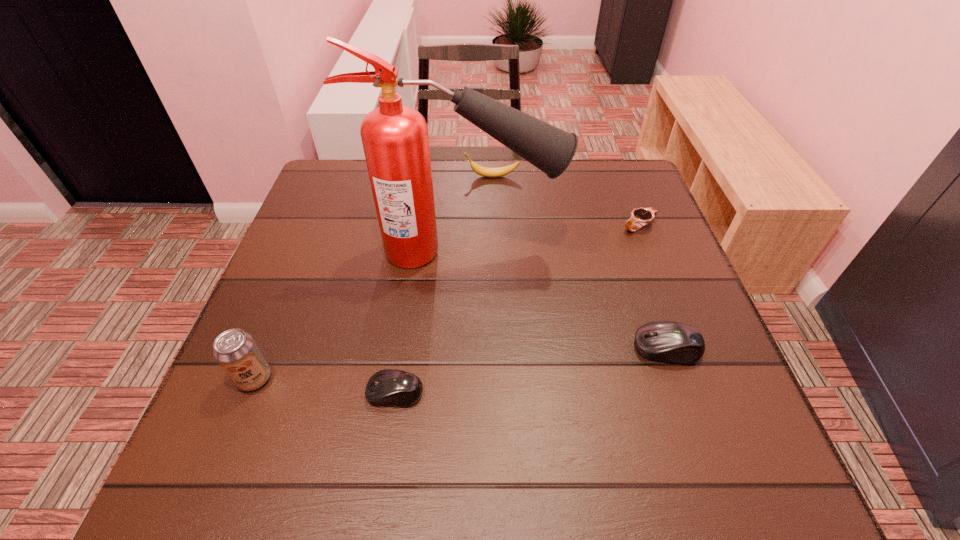
Locate an element on the screen. free space at the far right corner of the desktop is located at coordinates (623, 172).

This screenshot has height=540, width=960. What are the coordinates of `blank region between the fire extinguisher and the farther mouse` in the screenshot? It's located at (564, 300).

Find the location of a particular element. The image size is (960, 540). free space that is in between the right mouse and the third tallest object is located at coordinates (579, 262).

The image size is (960, 540). I want to click on vacant area that lies between the nearer mouse and the second tallest object, so click(324, 386).

Locate an element on the screen. The width and height of the screenshot is (960, 540). free spot between the third shortest object and the fourth shortest object is located at coordinates (579, 262).

Find the location of a particular element. The image size is (960, 540). vacant space that's between the farthest object and the taller mouse is located at coordinates (579, 262).

The width and height of the screenshot is (960, 540). Identify the location of free space between the tallest object and the banana. (477, 214).

Where is `vacant area between the fire extinguisher and the beer can`? vacant area between the fire extinguisher and the beer can is located at coordinates (358, 315).

The image size is (960, 540). In order to click on vacant space that is in between the second tallest object and the taller mouse in this screenshot , I will do `click(461, 363)`.

I want to click on free point between the nearer mouse and the farther mouse, so click(x=531, y=370).